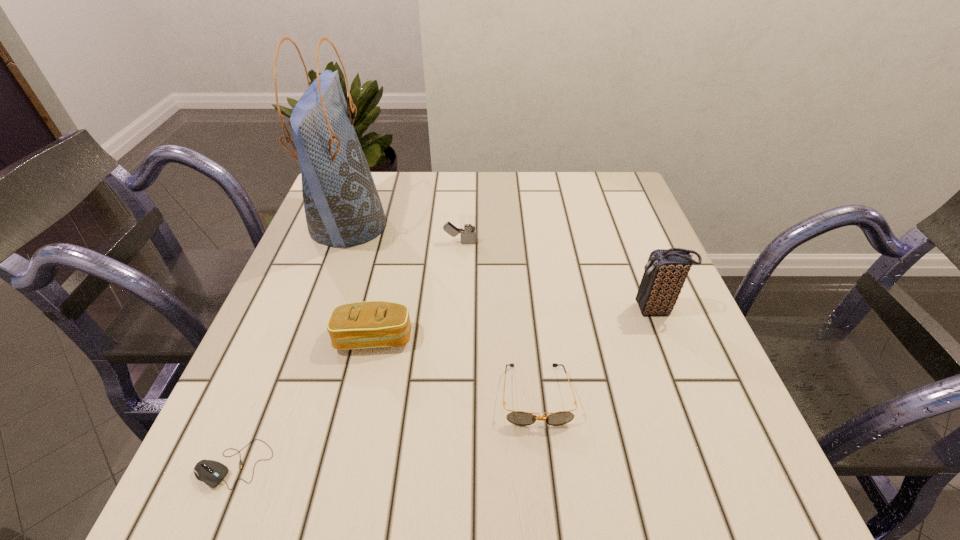
This screenshot has height=540, width=960. In order to click on vacant space that is in between the nearer clutch bag and the tallest object in this screenshot , I will do `click(361, 282)`.

Locate an element on the screen. This screenshot has height=540, width=960. free point between the shopping bag and the nearest object is located at coordinates (291, 345).

The image size is (960, 540). In order to click on free space between the igniter and the shortest object in this screenshot , I will do `click(348, 353)`.

This screenshot has width=960, height=540. Identify the location of object that is the fourth closest to the fourth object from left to right. (666, 271).

Find the location of a particular element. This screenshot has height=540, width=960. object that is the second closest to the left clutch bag is located at coordinates (520, 418).

At what (x,y) coordinates should I click in order to perform the action: click on vacant position in the image that satisfies the following two spatial constraints: 1. with the zip open on the right clutch bag; 2. on the front side of the nearest object. Please return your answer as a coordinate pair (x, y). Looking at the image, I should click on (716, 464).

In order to click on vacant region that satisfies the following two spatial constraints: 1. on the back side of the tallest object; 2. on the left side of the computer mouse in this screenshot , I will do `click(332, 225)`.

Locate an element on the screen. This screenshot has width=960, height=540. free space that satisfies the following two spatial constraints: 1. with the zip open on the third farthest object; 2. on the zipper side of the left clutch bag is located at coordinates (667, 339).

I want to click on vacant space that satisfies the following two spatial constraints: 1. with the zip open on the taller clutch bag; 2. on the zipper side of the nearer clutch bag, so [667, 339].